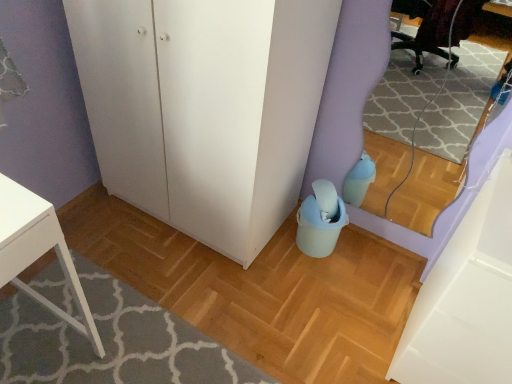
The height and width of the screenshot is (384, 512). What are the coordinates of `matte plastic bucket at lower center` in the screenshot? It's located at (113, 342).

From the picture: Measure the distance between white matte cabinet at lower right and camera.

They are 3.43 feet apart.

You are a GUI agent. You are given a task and a screenshot of the screen. Output one action in this format:
    pyautogui.click(x=<x>, y=<y>)
    Task: Click on the matte plastic bucket at lower center
    This screenshot has width=512, height=384.
    Given the screenshot: What is the action you would take?
    pyautogui.click(x=113, y=342)

Is white matte cabinet at lower right far from white matte cabinet at lower right?

Actually, white matte cabinet at lower right and white matte cabinet at lower right are a little close together.

Where is `dresser above the white matte cabinet at lower right (from a real-world perspective)`? The width and height of the screenshot is (512, 384). dresser above the white matte cabinet at lower right (from a real-world perspective) is located at coordinates (204, 108).

From the image's perspective, is white matte cabinet at lower right on white matte cabinet at lower right?

Actually, white matte cabinet at lower right appears below white matte cabinet at lower right in the image.

Between white matte cabinet at lower right and white matte cabinet at lower right, which one has smaller width?

With smaller width is white matte cabinet at lower right.

From the image's perspective, is white matte cabinet at lower right located beneath matte plastic bucket at lower center?

No, from the image's perspective, white matte cabinet at lower right is not beneath matte plastic bucket at lower center.

Is white matte cabinet at lower right oriented away from matte plastic bucket at lower center?

No, matte plastic bucket at lower center is not at the back of white matte cabinet at lower right.

Relative to matte plastic bucket at lower center, is white matte cabinet at lower right in front or behind?

white matte cabinet at lower right is in front of matte plastic bucket at lower center.

What's the angular difference between white matte cabinet at lower right and matte plastic bucket at lower center's facing directions?

89.9 degrees.

From a real-world perspective, is white matte cabinet at lower right physically located above or below matte plastic bucket at lower center?

Clearly, from a real-world perspective, white matte cabinet at lower right is above matte plastic bucket at lower center.

Is white matte cabinet at lower right turned away from matte plastic bucket at lower center?

No.

Between white matte cabinet at lower right and matte plastic bucket at lower center, which one is positioned behind?

matte plastic bucket at lower center is more distant.

Is white matte cabinet at lower right surrounded by white matte cabinet at lower right?

Actually, white matte cabinet at lower right is outside white matte cabinet at lower right.

Does white matte cabinet at lower right have a larger size compared to white matte cabinet at lower right?

Correct, white matte cabinet at lower right is larger in size than white matte cabinet at lower right.

How different are the orientations of white matte cabinet at lower right and white matte cabinet at lower right in degrees?

The angular difference between white matte cabinet at lower right and white matte cabinet at lower right is 0.734 degrees.

Considering the sizes of objects matte plastic bucket at lower center and white matte cabinet at lower right in the image provided, who is shorter, matte plastic bucket at lower center or white matte cabinet at lower right?

matte plastic bucket at lower center.

Is there a large distance between matte plastic bucket at lower center and white matte cabinet at lower right?

matte plastic bucket at lower center is actually quite close to white matte cabinet at lower right.

Does point (140, 331) appear closer or farther from the camera than point (489, 278)?

Point (140, 331) appears to be farther away from the viewer than point (489, 278).

Locate an element on the screen. The image size is (512, 384). dresser located in front of the matte plastic bucket at lower center is located at coordinates click(204, 108).

Considering the sizes of matte plastic bucket at lower center and white matte cabinet at lower right in the image, is matte plastic bucket at lower center taller or shorter than white matte cabinet at lower right?

In the image, matte plastic bucket at lower center appears to be shorter than white matte cabinet at lower right.

From the image's perspective, relative to white matte cabinet at lower right, is matte plastic bucket at lower center above or below?

Based on their image positions, matte plastic bucket at lower center is located beneath white matte cabinet at lower right.

Where is `dresser above the white matte cabinet at lower right (from a real-world perspective)`? This screenshot has width=512, height=384. dresser above the white matte cabinet at lower right (from a real-world perspective) is located at coordinates (204, 108).

The image size is (512, 384). In the image, there is a white matte cabinet at lower right. Identify the location of plain below it (from a real-world perspective). (113, 342).

When comparing their distances from white matte cabinet at lower right, does white matte cabinet at lower right or matte plastic bucket at lower center seem further?

Among the two, white matte cabinet at lower right is located further to white matte cabinet at lower right.

Estimate the real-world distances between objects in this image. Which object is closer to matte plastic bucket at lower center, white matte cabinet at lower right or white matte cabinet at lower right?

Based on the image, white matte cabinet at lower right appears to be nearer to matte plastic bucket at lower center.

Which object lies nearer to the anchor point white matte cabinet at lower right, matte plastic bucket at lower center or white matte cabinet at lower right?

matte plastic bucket at lower center lies closer to white matte cabinet at lower right than the other object.

Considering their positions, is matte plastic bucket at lower center positioned further to white matte cabinet at lower right than white matte cabinet at lower right?

matte plastic bucket at lower center.

From the image, which object appears to be farther from white matte cabinet at lower right, white matte cabinet at lower right or matte plastic bucket at lower center?

matte plastic bucket at lower center is positioned further to the anchor white matte cabinet at lower right.

Looking at the image, which one is located closer to matte plastic bucket at lower center, white matte cabinet at lower right or white matte cabinet at lower right?

white matte cabinet at lower right is positioned closer to the anchor matte plastic bucket at lower center.

In order to click on dresser between matte plastic bucket at lower center and white matte cabinet at lower right from left to right in this screenshot , I will do `click(204, 108)`.